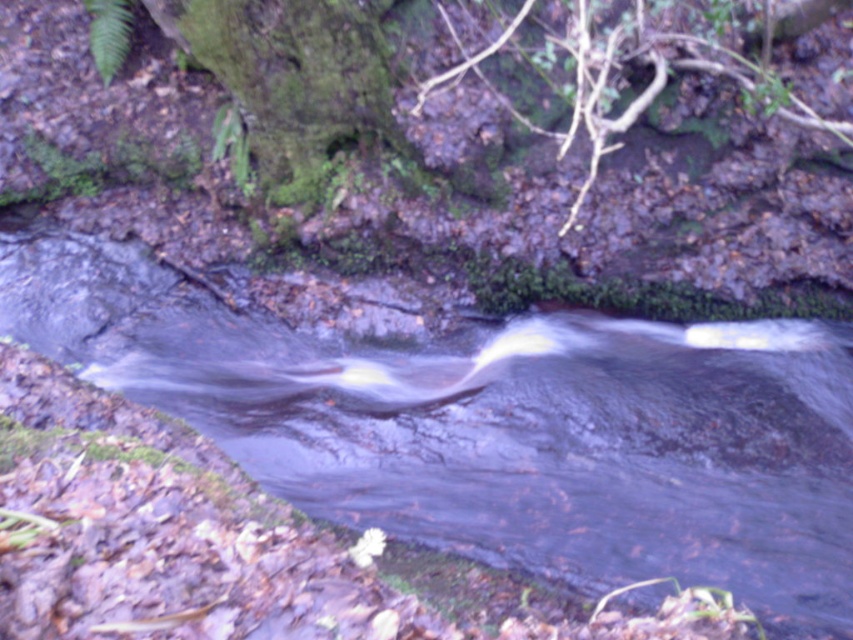
Question: Is clear water at center smaller than green mossy tree trunk at upper center?

Choices:
 (A) yes
 (B) no

Answer: (B)

Question: Observing the image, what is the correct spatial positioning of clear water at center in reference to green mossy tree trunk at upper center?

Choices:
 (A) below
 (B) above

Answer: (A)

Question: Is clear water at center smaller than green mossy tree trunk at upper center?

Choices:
 (A) yes
 (B) no

Answer: (B)

Question: Which point appears farthest from the camera in this image?

Choices:
 (A) (379, 417)
 (B) (306, 164)

Answer: (B)